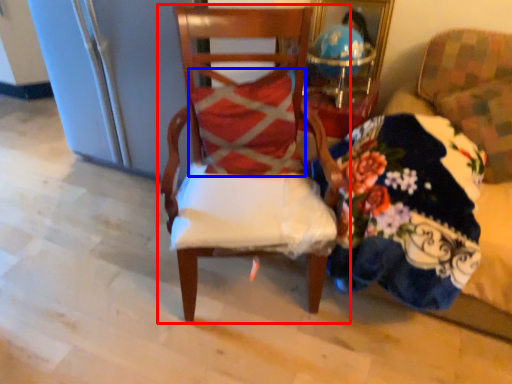
Question: Which object is further to the camera taking this photo, chair (highlighted by a red box) or pillow (highlighted by a blue box)?

Choices:
 (A) chair
 (B) pillow

Answer: (B)